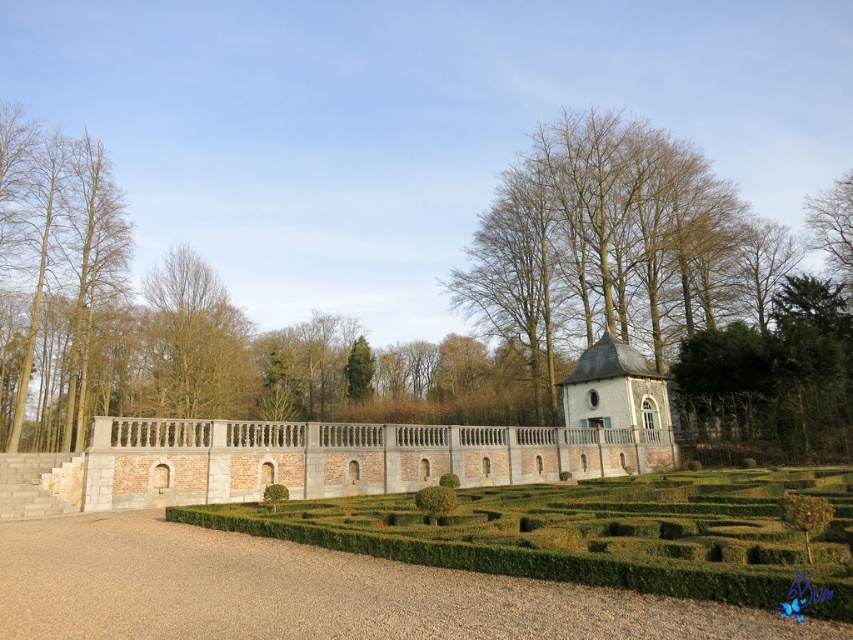
You are planning to host a garden party and need to set up a stage. The stage requires a large open space. Based on the garden scene, which of the two central objects, the green hedge maze at center or the green leafy tree at center, would you choose to place the stage near for more space?

The green leafy tree at center occupies more space than the green hedge maze at center, so placing the stage near the green hedge maze at center would provide a larger open area for the stage.

You are standing at the entrance of the hedge maze in the garden. You want to reach the pavilion at the end of the brick wall. Which direction should you walk to first get to the green leafy tree at center before proceeding to the pavilion?

The green leafy tree at center is located at coordinates point (195, 340), so you should walk towards the center of the garden to reach it before heading toward the pavilion.

You are standing at the entrance of the garden and want to reach the pavilion. There are two points marked in the image, point A at coordinates point (229, 356) and point B at coordinates point (366, 365). Which point is closer to you as you start your journey towards the pavilion?

Point point (229, 356) is closer to the viewer than point point (366, 365), so point A is closer to you as you start your journey towards the pavilion.